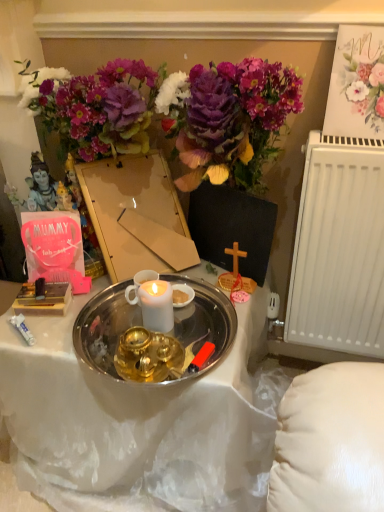
Based on the photo, measure the distance between point (250, 405) and camera.

The distance of point (250, 405) from camera is 1.11 meters.

Image resolution: width=384 pixels, height=512 pixels. What do you see at coordinates (134, 421) in the screenshot?
I see `metallic tray at center` at bounding box center [134, 421].

This screenshot has width=384, height=512. In order to click on metallic tray at center in this screenshot , I will do `click(134, 421)`.

Locate an element on the screen. This screenshot has width=384, height=512. metallic tray at center is located at coordinates (134, 421).